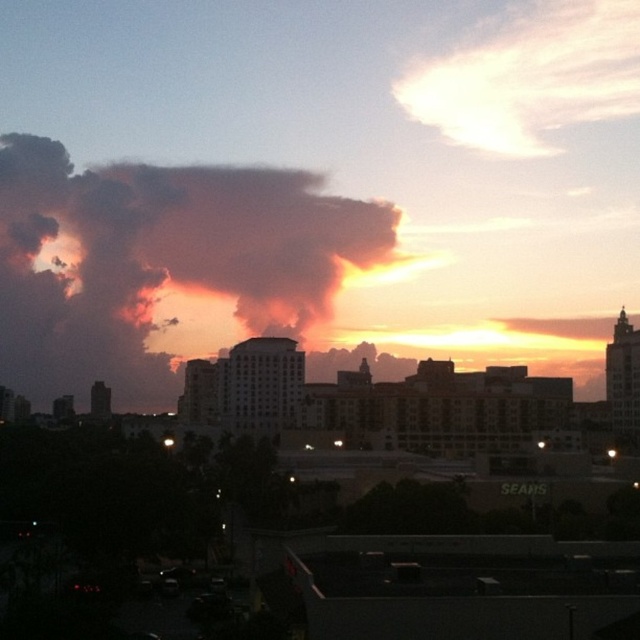
You are an artist trying to paint the cityscape. You notice two elements in the sky that need to be sized proportionally. Which object should you paint larger between the dark orange smoke at upper left and the pastel pink cotton cloud at upper right?

You should paint the dark orange smoke at upper left larger than the pastel pink cotton cloud at upper right because it is bigger according to the description.